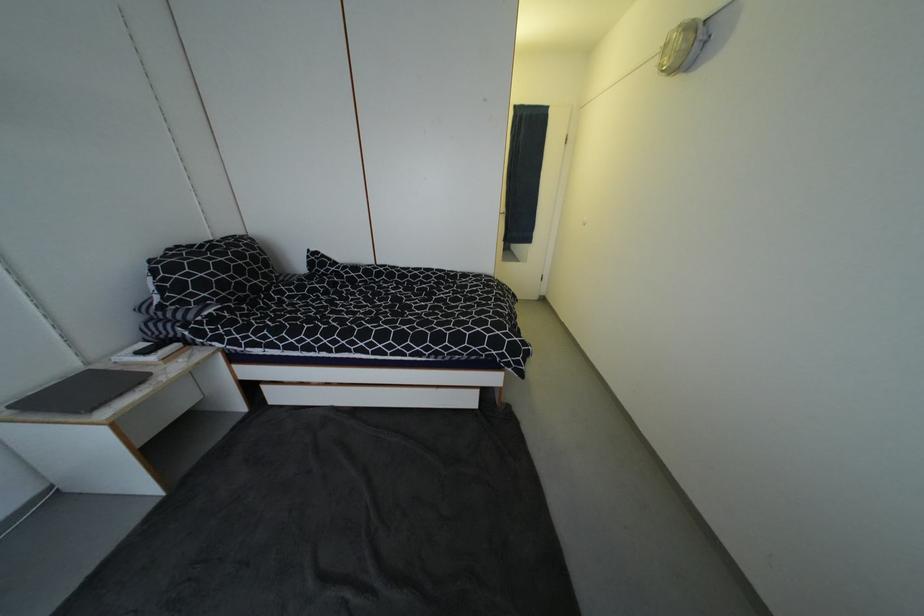
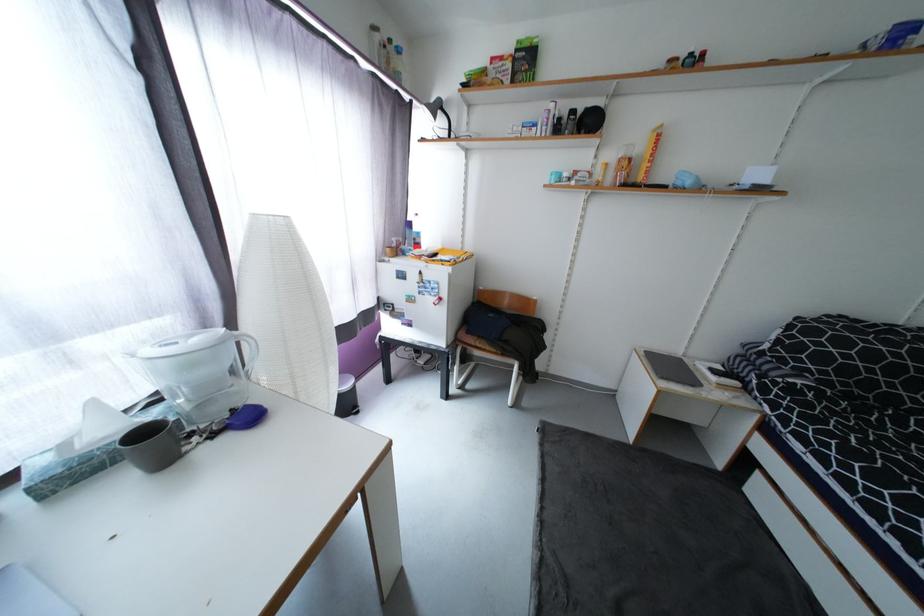
The point at (180, 347) is marked in the first image. Where is the corresponding point in the second image?

(740, 385)